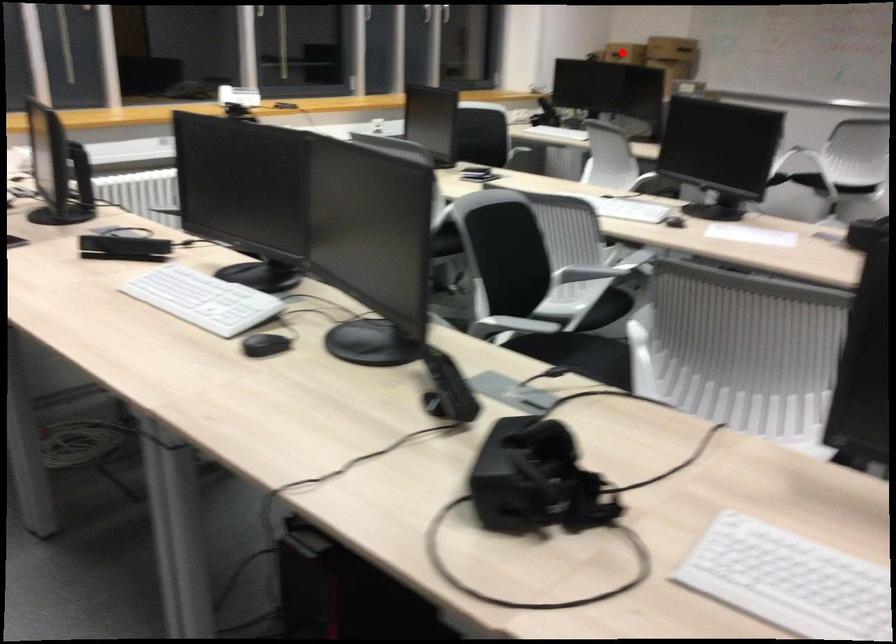
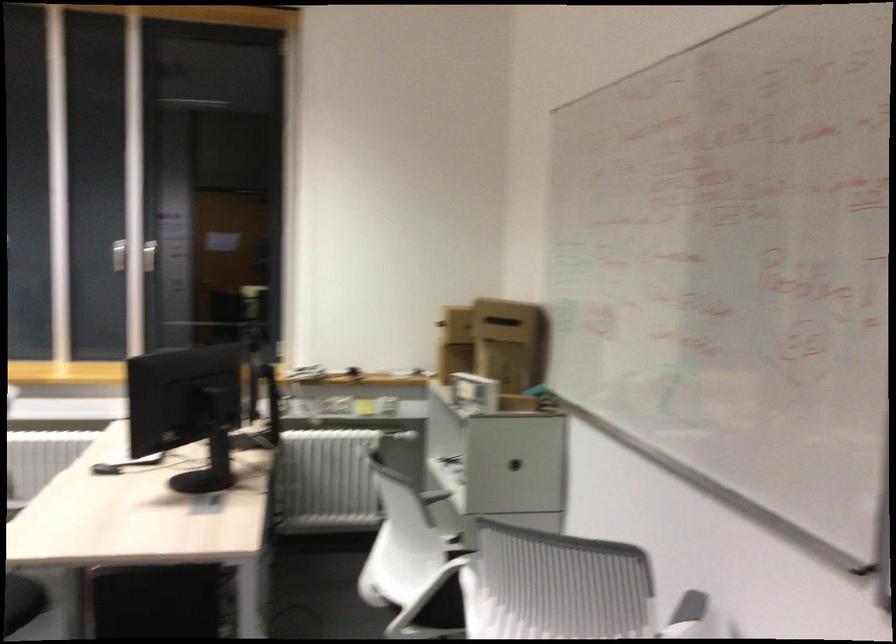
Question: I am providing you with two images of the same scene from different viewpoints. A red point is marked on the first image. Can you still see the location of the red point in image 2?

Choices:
 (A) Yes
 (B) No

Answer: (B)